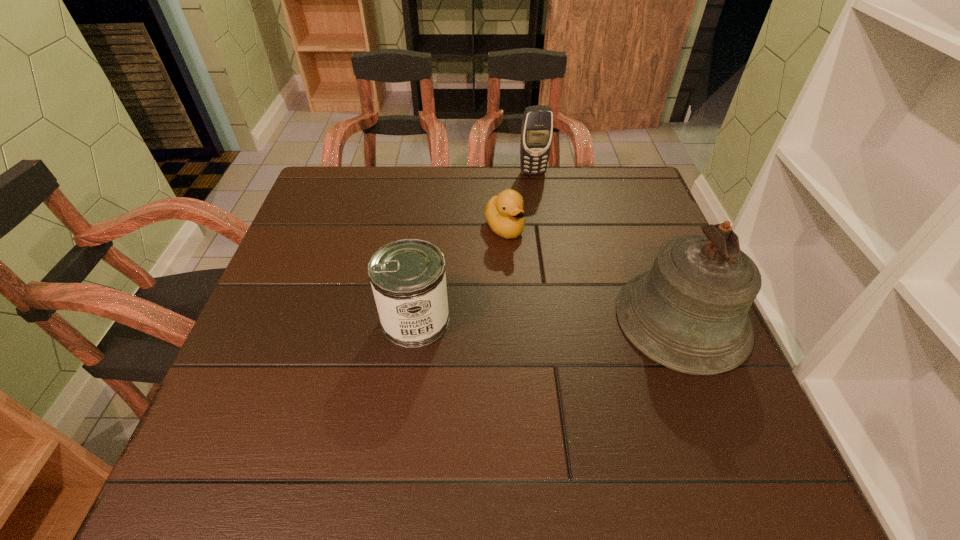
The height and width of the screenshot is (540, 960). What are the coordinates of `vacant position located 0.130m on the front face of the farthest object` in the screenshot? It's located at (543, 203).

This screenshot has width=960, height=540. Identify the location of blank area located on the front face of the farthest object. (540, 193).

Find the location of a particular element. This screenshot has height=540, width=960. vacant space situated 0.230m on the front face of the farthest object is located at coordinates (550, 226).

Image resolution: width=960 pixels, height=540 pixels. In order to click on free space located on the face of the duckling in this screenshot , I will do `click(525, 256)`.

The width and height of the screenshot is (960, 540). What are the coordinates of `vacant region located on the face of the duckling` in the screenshot? It's located at (536, 269).

At what (x,y) coordinates should I click in order to perform the action: click on free space located 0.280m on the face of the duckling. Please return your answer as a coordinate pair (x, y). The width and height of the screenshot is (960, 540). Looking at the image, I should click on (581, 323).

This screenshot has height=540, width=960. In order to click on cellular telephone that is positioned at the far edge in this screenshot , I will do `click(537, 126)`.

Image resolution: width=960 pixels, height=540 pixels. In order to click on duckling present at the far edge in this screenshot , I will do `click(504, 213)`.

Find the location of a particular element. object located at the right edge is located at coordinates (688, 313).

This screenshot has width=960, height=540. In the image, there is a desktop. What are the coordinates of `vacant space at the far edge` in the screenshot? It's located at (573, 170).